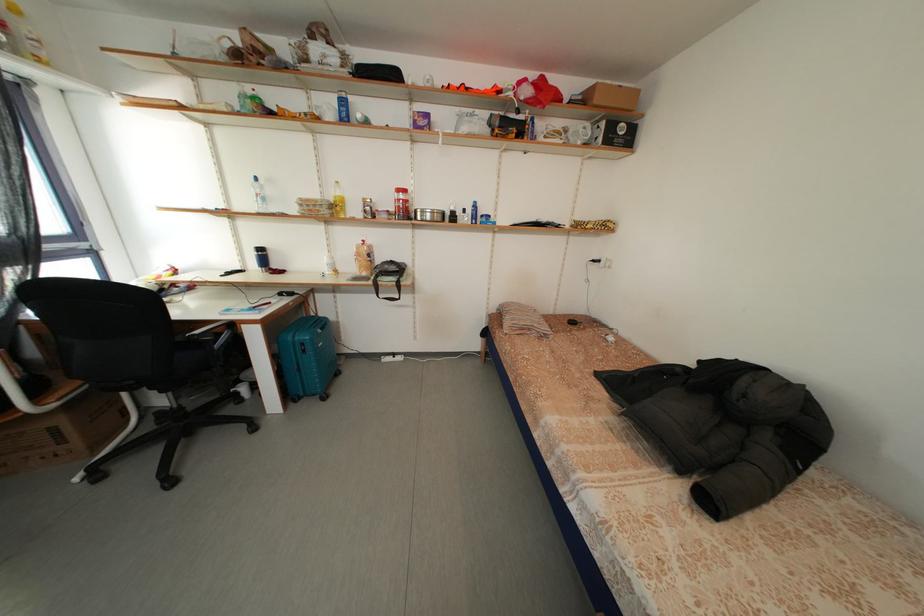
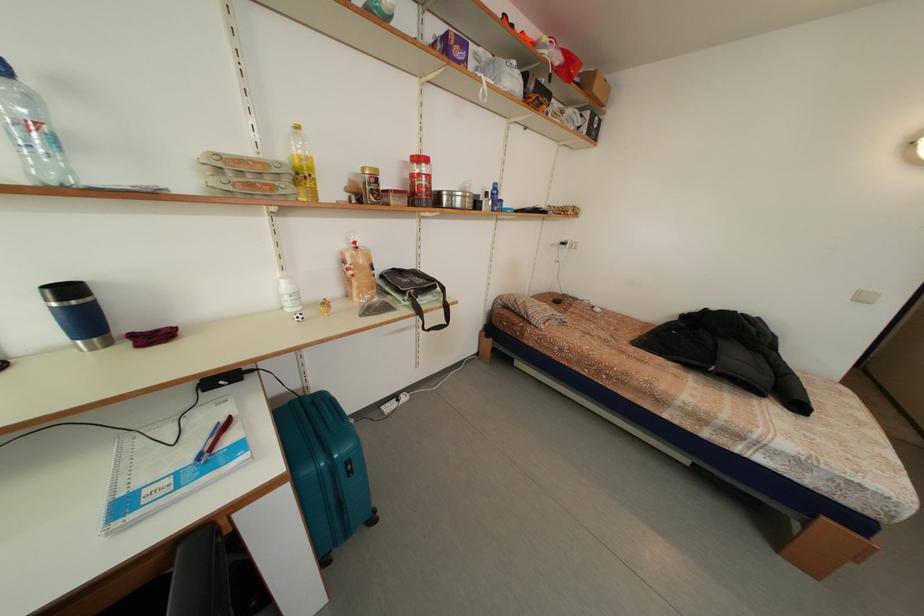
The point at (271,193) is marked in the first image. Where is the corresponding point in the second image?

(40, 106)